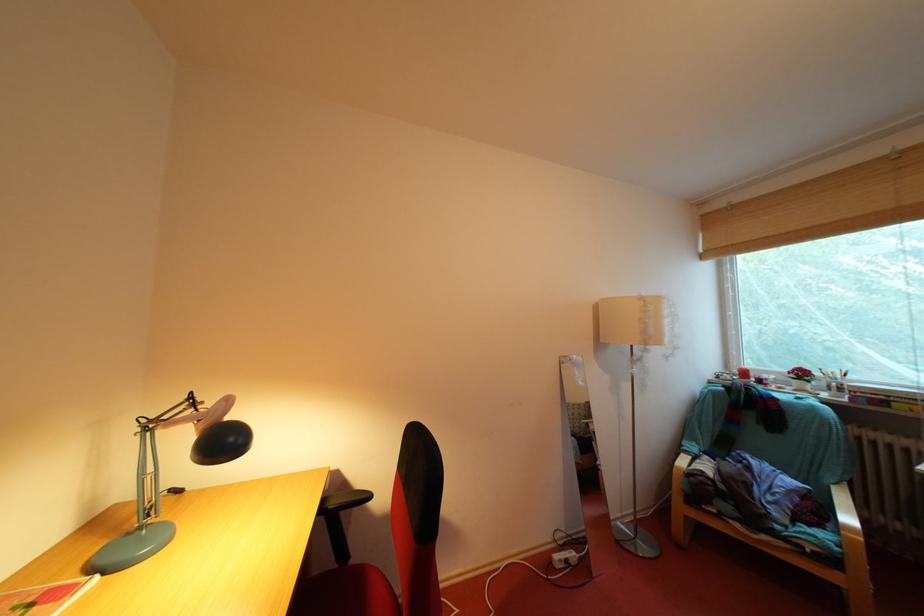
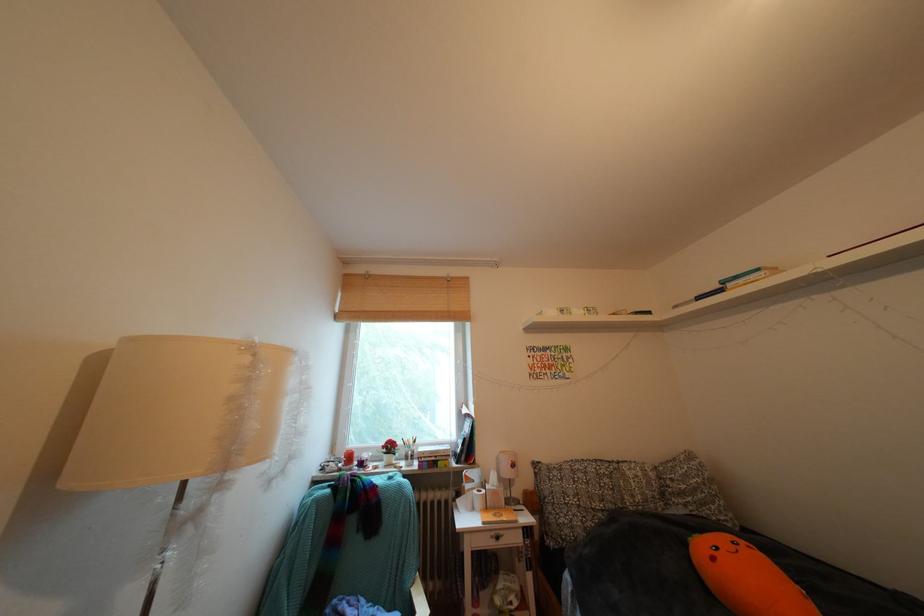
The images are taken continuously from a first-person perspective. In which direction is your viewpoint rotating?

The camera rotated toward right-up.